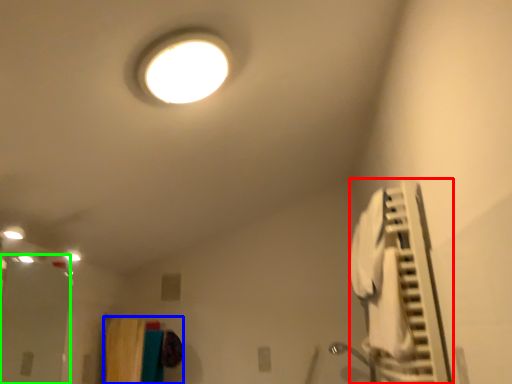
Question: Which object is positioned closest to air conditioner (highlighted by a red box)? Select from laundry (highlighted by a blue box) and glass door (highlighted by a green box).

Choices:
 (A) laundry
 (B) glass door

Answer: (A)